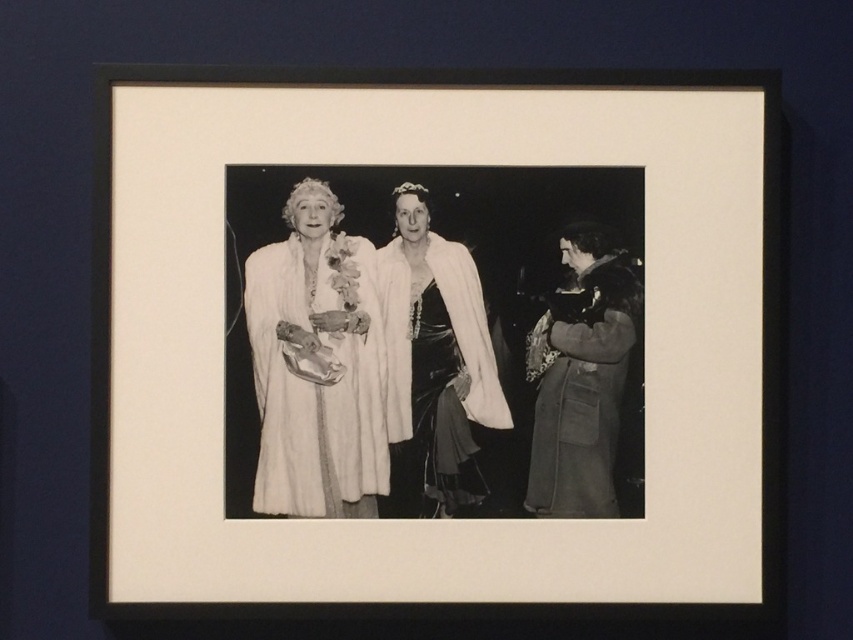
Question: Based on their relative distances, which object is nearer to the white fur coat at center?

Choices:
 (A) velvet brown coat at right
 (B) velvet black dress at center

Answer: (B)

Question: Can you confirm if white fur coat at center is positioned below velvet brown coat at right?

Choices:
 (A) yes
 (B) no

Answer: (B)

Question: Which point appears farthest from the camera in this image?

Choices:
 (A) (471, 408)
 (B) (103, 524)
 (C) (540, 330)

Answer: (C)

Question: Considering the real-world distances, which object is farthest from the velvet brown coat at right?

Choices:
 (A) white fur coat at center
 (B) black matte picture frame at center

Answer: (A)

Question: Does velvet black dress at center appear on the left side of velvet brown coat at right?

Choices:
 (A) no
 (B) yes

Answer: (B)

Question: From the image, what is the correct spatial relationship of black matte picture frame at center in relation to velvet brown coat at right?

Choices:
 (A) right
 (B) left

Answer: (B)